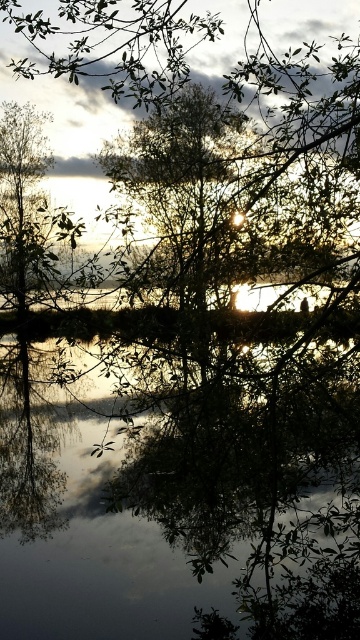
You are an artist planning to paint the scene. You want to ensure the proportions between the green leafy tree at center and the silvery metallic tree at left are accurate. Which tree should you paint as taller?

The silvery metallic tree at left is taller than the green leafy tree at center, so you should paint the silvery metallic tree at left as taller.

You are standing in the serene natural scene and want to take a photo of the green leafy tree at center. Since the transparent water at center is in the way, can you see the tree through the water?

The transparent water at center is positioned under green leafy tree at center, so yes, you can see the green leafy tree at center through the transparent water at center because the water is clear and the tree is above it.